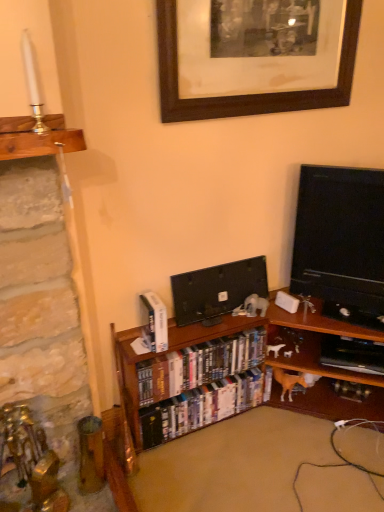
Locate an element on the screen. The height and width of the screenshot is (512, 384). vacant area that lies to the right of white glossy book at center, placed as the 3th book when sorted from bottom to top is located at coordinates (186, 337).